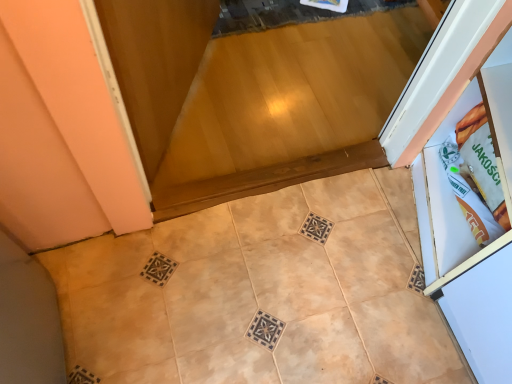
Question: From a real-world perspective, is beige matte tile at lower left, the 1th ceramic tile viewed from the right, physically located above or below beige matte tile at center, placed as the first ceramic tile when sorted from left to right?

Choices:
 (A) above
 (B) below

Answer: (A)

Question: Is point (86, 354) closer or farther from the camera than point (224, 281)?

Choices:
 (A) closer
 (B) farther

Answer: (A)

Question: Based on their positions, is beige matte tile at lower left, the 1th ceramic tile viewed from the right, located to the left or right of beige matte tile at center, placed as the first ceramic tile when sorted from left to right?

Choices:
 (A) right
 (B) left

Answer: (A)

Question: Choose the correct answer: Is beige matte tile at center, the second ceramic tile when ordered from right to left, inside beige matte tile at lower left, the 1th ceramic tile viewed from the right, or outside it?

Choices:
 (A) inside
 (B) outside

Answer: (A)

Question: Is beige matte tile at center, placed as the first ceramic tile when sorted from left to right, to the left or to the right of beige matte tile at lower left, the 1th ceramic tile viewed from the right, in the image?

Choices:
 (A) left
 (B) right

Answer: (A)

Question: From a real-world perspective, is beige matte tile at center, the second ceramic tile when ordered from right to left, positioned above or below beige matte tile at lower left, the 1th ceramic tile viewed from the right?

Choices:
 (A) above
 (B) below

Answer: (B)

Question: Based on their sizes in the image, would you say beige matte tile at center, the second ceramic tile when ordered from right to left, is bigger or smaller than beige matte tile at lower left, the 2th ceramic tile in the left-to-right sequence?

Choices:
 (A) big
 (B) small

Answer: (B)